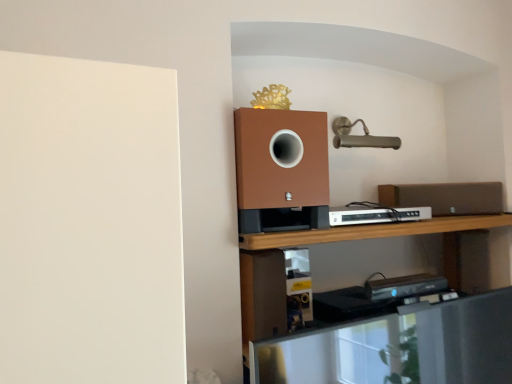
Describe the element at coordinates (337, 241) in the screenshot. I see `metallic silver shelf at lower center` at that location.

Measure the distance between metallic silver shelf at lower center and camera.

3.87 feet.

This screenshot has height=384, width=512. Find the location of `metallic silver shelf at lower center`. metallic silver shelf at lower center is located at coordinates (337, 241).

Who is bigger, metallic silver shelf at lower center or brown matte speaker at right?

With larger size is metallic silver shelf at lower center.

What's the angular difference between metallic silver shelf at lower center and brown matte speaker at right's facing directions?

metallic silver shelf at lower center and brown matte speaker at right are facing 24.4 degrees away from each other.

Is the depth of metallic silver shelf at lower center greater than that of brown matte speaker at right?

That is False.

Could brown matte speaker at right be considered to be inside metallic silver shelf at lower center?

No, brown matte speaker at right is not surrounded by metallic silver shelf at lower center.

From a real-world perspective, which is physically above, metallic silver shelf at lower center or white plastic dvd player at center?

In real-world perspective, white plastic dvd player at center is above.

Between metallic silver shelf at lower center and white plastic dvd player at center, which one has smaller size?

white plastic dvd player at center.

From the image's perspective, relative to white plastic dvd player at center, is metallic silver shelf at lower center above or below?

Based on their image positions, metallic silver shelf at lower center is located beneath white plastic dvd player at center.

Can you tell me how much white plastic dvd player at center and brown matte speaker at right differ in facing direction?

The facing directions of white plastic dvd player at center and brown matte speaker at right are 22.2 degrees apart.

Considering the sizes of white plastic dvd player at center and brown matte speaker at right in the image, is white plastic dvd player at center taller or shorter than brown matte speaker at right?

In the image, white plastic dvd player at center appears to be shorter than brown matte speaker at right.

Considering their positions, is white plastic dvd player at center located in front of or behind brown matte speaker at right?

white plastic dvd player at center is positioned closer to the viewer than brown matte speaker at right.

From the image's perspective, relative to brown matte speaker at right, is white plastic dvd player at center above or below?

white plastic dvd player at center is below brown matte speaker at right.

Who is bigger, white plastic dvd player at center or metallic silver shelf at lower center?

metallic silver shelf at lower center is bigger.

How different are the orientations of white plastic dvd player at center and metallic silver shelf at lower center in degrees?

The angle between the facing direction of white plastic dvd player at center and the facing direction of metallic silver shelf at lower center is 2.13 degrees.

Is white plastic dvd player at center next to metallic silver shelf at lower center and touching it?

They are not placed beside each other.

Could you tell me if white plastic dvd player at center is facing metallic silver shelf at lower center?

No, white plastic dvd player at center is not aimed at metallic silver shelf at lower center.

From the image's perspective, would you say brown matte speaker at right is shown under white plastic dvd player at center?

No, from the image's perspective, brown matte speaker at right is not below white plastic dvd player at center.

Is brown matte speaker at right placed right next to white plastic dvd player at center?

They are not placed beside each other.

Can you confirm if brown matte speaker at right is taller than white plastic dvd player at center?

Indeed, brown matte speaker at right has a greater height compared to white plastic dvd player at center.

Is brown matte speaker at right to the left or to the right of metallic silver shelf at lower center in the image?

Based on their positions, brown matte speaker at right is located to the right of metallic silver shelf at lower center.

Does brown matte speaker at right have a lesser height compared to metallic silver shelf at lower center?

Yes.

Based on the photo, is brown matte speaker at right turned away from metallic silver shelf at lower center?

brown matte speaker at right is not turned away from metallic silver shelf at lower center.

Locate an element on the screen. shelf below the brown matte speaker at right (from the image's perspective) is located at coordinates (337, 241).

Identify the location of appliance on the left of the metallic silver shelf at lower center. (376, 214).

Which object lies nearer to the anchor point white plastic dvd player at center, brown matte speaker at right or metallic silver shelf at lower center?

metallic silver shelf at lower center is closer to white plastic dvd player at center.

Looking at the image, which one is located further to brown matte speaker at right, white plastic dvd player at center or metallic silver shelf at lower center?

metallic silver shelf at lower center lies further to brown matte speaker at right than the other object.

From the picture: Which object lies further to the anchor point brown matte speaker at right, metallic silver shelf at lower center or white plastic dvd player at center?

Based on the image, metallic silver shelf at lower center appears to be further to brown matte speaker at right.

Considering their positions, is metallic silver shelf at lower center positioned closer to white plastic dvd player at center than brown matte speaker at right?

The object closer to white plastic dvd player at center is metallic silver shelf at lower center.

When comparing their distances from metallic silver shelf at lower center, does white plastic dvd player at center or brown matte speaker at right seem further?

brown matte speaker at right is further to metallic silver shelf at lower center.

Looking at the image, which one is located further to metallic silver shelf at lower center, brown matte speaker at right or white plastic dvd player at center?

brown matte speaker at right is positioned further to the anchor metallic silver shelf at lower center.

This screenshot has width=512, height=384. I want to click on appliance between metallic silver shelf at lower center and brown matte speaker at right from front to back, so click(x=376, y=214).